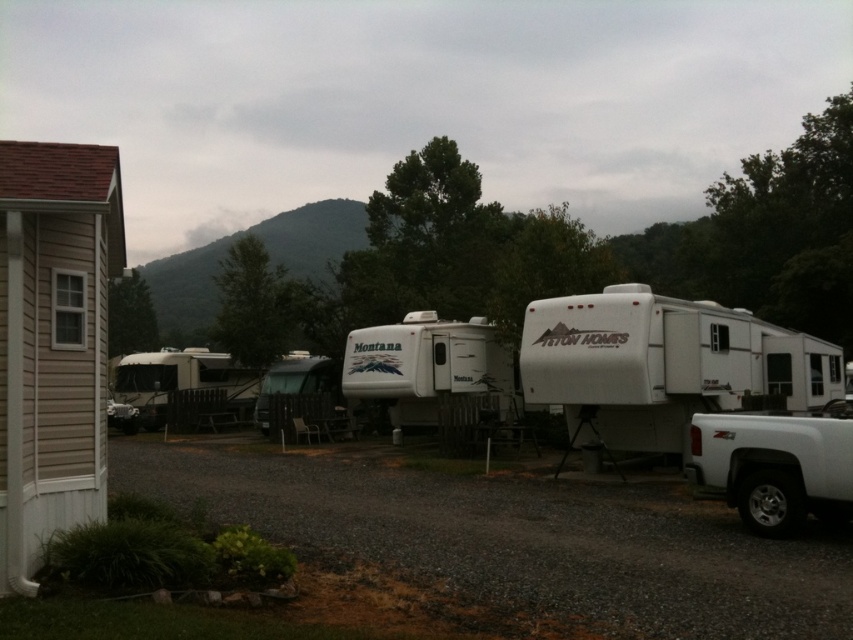
Can you confirm if white matte pickup truck at center-right is smaller than white matte camper at center?

Actually, white matte pickup truck at center-right might be larger than white matte camper at center.

The height and width of the screenshot is (640, 853). What are the coordinates of `white matte pickup truck at center-right` in the screenshot? It's located at (662, 364).

The image size is (853, 640). In order to click on white matte pickup truck at center-right in this screenshot , I will do `click(662, 364)`.

This screenshot has height=640, width=853. I want to click on white matte pickup truck at center-right, so click(x=662, y=364).